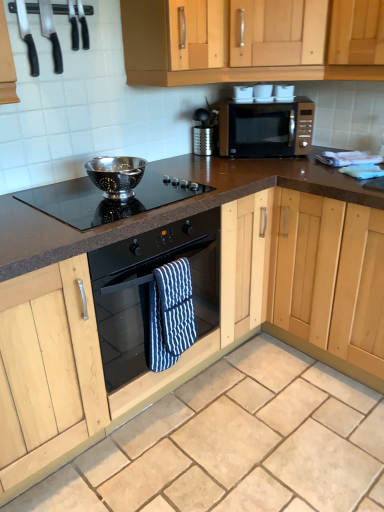
What is the approximate height of black glass cooktop at center?

It is 3.60 centimeters.

The width and height of the screenshot is (384, 512). In order to click on black plastic knives at upper left, placed as the 2th appliance when sorted from left to right in this screenshot , I will do point(51,33).

Image resolution: width=384 pixels, height=512 pixels. Describe the element at coordinates (51, 33) in the screenshot. I see `black plastic knives at upper left, placed as the 2th appliance when sorted from left to right` at that location.

The image size is (384, 512). What do you see at coordinates (27, 37) in the screenshot? I see `black plastic knives at upper left, which appears as the 1th appliance when viewed from the left` at bounding box center [27, 37].

Measure the distance between blue striped oven mitt at center and camera.

blue striped oven mitt at center is 1.48 meters from camera.

Identify the location of blue striped oven mitt at center. (168, 314).

Find the location of a particular element. The image size is (384, 512). light wood cabinet at upper center, which is the 2th cabinetry from bottom to top is located at coordinates (278, 32).

Measure the distance between point (265, 499) and camera.

Point (265, 499) and camera are 1.45 meters apart.

Where is `beige granite countertop at center`? beige granite countertop at center is located at coordinates (236, 444).

You are a GUI agent. You are given a task and a screenshot of the screen. Output one action in this format:
    pyautogui.click(x=<x>, y=<y>)
    Task: Click on the black glass oven at center
    This screenshot has height=512, width=384.
    Given the screenshot: What is the action you would take?
    pyautogui.click(x=148, y=289)

From a real-world perspective, between matte black oven at center, which is counted as the second cabinetry, starting from the top, and satin gold microwave at upper center, who is vertically higher?

satin gold microwave at upper center, from a real-world perspective.

Can you confirm if matte black oven at center, which is counted as the second cabinetry, starting from the top, is wider than satin gold microwave at upper center?

Indeed, matte black oven at center, which is counted as the second cabinetry, starting from the top, has a greater width compared to satin gold microwave at upper center.

Is matte black oven at center, arranged as the first cabinetry when ordered from the bottom, in contact with satin gold microwave at upper center?

matte black oven at center, arranged as the first cabinetry when ordered from the bottom, is not next to satin gold microwave at upper center, and they're not touching.

Locate an element on the screen. microwave oven above the matte black oven at center, arranged as the first cabinetry when ordered from the bottom (from the image's perspective) is located at coordinates (266, 128).

From a real-world perspective, between black glass cooktop at center and black plastic knives at upper left, placed as the 2th appliance when sorted from left to right, who is vertically higher?

From a 3D spatial view, black plastic knives at upper left, placed as the 2th appliance when sorted from left to right, is above.

Is black glass cooktop at center with black plastic knives at upper left, which ranks as the first appliance in right-to-left order?

No.

From the image's perspective, is black glass cooktop at center above or below black plastic knives at upper left, placed as the 2th appliance when sorted from left to right?

Clearly, from the image's perspective, black glass cooktop at center is below black plastic knives at upper left, placed as the 2th appliance when sorted from left to right.

Looking at their sizes, would you say black glass cooktop at center is wider or thinner than black plastic knives at upper left, which ranks as the first appliance in right-to-left order?

Clearly, black glass cooktop at center has more width compared to black plastic knives at upper left, which ranks as the first appliance in right-to-left order.

Considering the positions of objects blue striped oven mitt at center and satin gold microwave at upper center in the image provided, who is more to the left, blue striped oven mitt at center or satin gold microwave at upper center?

From the viewer's perspective, blue striped oven mitt at center appears more on the left side.

Is blue striped oven mitt at center looking in the opposite direction of satin gold microwave at upper center?

No, blue striped oven mitt at center is not facing the opposite direction of satin gold microwave at upper center.

The width and height of the screenshot is (384, 512). In order to click on bath towel lying below the satin gold microwave at upper center (from the image's perspective) in this screenshot , I will do `click(168, 314)`.

Who is smaller, light wood cabinet at upper center, which is the 2th cabinetry from bottom to top, or blue striped oven mitt at center?

Smaller between the two is blue striped oven mitt at center.

Is blue striped oven mitt at center a part of light wood cabinet at upper center, which appears as the first cabinetry when viewed from the top?

No, blue striped oven mitt at center is not surrounded by light wood cabinet at upper center, which appears as the first cabinetry when viewed from the top.

How much distance is there between light wood cabinet at upper center, which is the 2th cabinetry from bottom to top, and blue striped oven mitt at center?

They are 1.09 meters apart.

From the image's perspective, is light wood cabinet at upper center, which is the 2th cabinetry from bottom to top, above blue striped oven mitt at center?

Result: Yes.

Would you say black glass cooktop at center is outside blue striped oven mitt at center?

black glass cooktop at center lies outside blue striped oven mitt at center's area.

How much distance is there between black glass cooktop at center and blue striped oven mitt at center?

black glass cooktop at center and blue striped oven mitt at center are 15.69 inches apart.

Considering the sizes of objects black glass cooktop at center and blue striped oven mitt at center in the image provided, who is wider, black glass cooktop at center or blue striped oven mitt at center?

With larger width is black glass cooktop at center.

Is black glass cooktop at center in contact with blue striped oven mitt at center?

No, black glass cooktop at center is not touching blue striped oven mitt at center.

Where is `cabinetry that is on the right side of blue striped oven mitt at center`? cabinetry that is on the right side of blue striped oven mitt at center is located at coordinates (278, 32).

Which object is thinner, blue striped oven mitt at center or light wood cabinet at upper center, which is the 2th cabinetry from bottom to top?

Thinner between the two is blue striped oven mitt at center.

Considering the positions of objects blue striped oven mitt at center and light wood cabinet at upper center, which appears as the first cabinetry when viewed from the top, in the image provided, who is more to the right, blue striped oven mitt at center or light wood cabinet at upper center, which appears as the first cabinetry when viewed from the top,?

From the viewer's perspective, light wood cabinet at upper center, which appears as the first cabinetry when viewed from the top, appears more on the right side.

From a real-world perspective, is blue striped oven mitt at center over light wood cabinet at upper center, which is the 2th cabinetry from bottom to top?

No, from a real-world perspective, blue striped oven mitt at center is not over light wood cabinet at upper center, which is the 2th cabinetry from bottom to top

From a real-world perspective, who is located lower, black glass oven at center or black plastic knives at upper left, placed as the 2th appliance when sorted from left to right?

black glass oven at center is physically lower.

Measure the distance between black glass oven at center and black plastic knives at upper left, which ranks as the first appliance in right-to-left order.

black glass oven at center is 37.39 inches from black plastic knives at upper left, which ranks as the first appliance in right-to-left order.

Who is taller, black glass oven at center or black plastic knives at upper left, which ranks as the first appliance in right-to-left order?

black glass oven at center is taller.

From the image's perspective, is black glass oven at center beneath black plastic knives at upper left, placed as the 2th appliance when sorted from left to right?

Indeed, from the image's perspective, black glass oven at center is shown beneath black plastic knives at upper left, placed as the 2th appliance when sorted from left to right.

There is a matte black oven at center, which is counted as the second cabinetry, starting from the top. At what (x,y) coordinates should I click in order to perform the action: click on microwave oven above it (from a real-world perspective). Please return your answer as a coordinate pair (x, y). The height and width of the screenshot is (512, 384). Looking at the image, I should click on (266, 128).

The height and width of the screenshot is (512, 384). In the image, there is a black plastic knives at upper left, placed as the 2th appliance when sorted from left to right. In order to click on gas stove below it (from the image's perspective) in this screenshot , I will do `click(106, 199)`.

From the picture: From the image, which object appears to be farther from beige granite countertop at center, light wood cabinet at upper center, which is the 2th cabinetry from bottom to top, or blue striped oven mitt at center?

Based on the image, light wood cabinet at upper center, which is the 2th cabinetry from bottom to top, appears to be further to beige granite countertop at center.

Which object lies further to the anchor point satin gold microwave at upper center, blue striped oven mitt at center or black plastic knives at upper left, which ranks as the first appliance in right-to-left order?

Based on the image, black plastic knives at upper left, which ranks as the first appliance in right-to-left order, appears to be further to satin gold microwave at upper center.

Considering their positions, is black glass cooktop at center positioned closer to beige granite countertop at center than blue striped oven mitt at center?

blue striped oven mitt at center is closer to beige granite countertop at center.

From the image, which object appears to be nearer to light wood cabinet at upper center, which is the 2th cabinetry from bottom to top, matte black oven at center, which is counted as the second cabinetry, starting from the top, or black glass cooktop at center?

Among the two, black glass cooktop at center is located nearer to light wood cabinet at upper center, which is the 2th cabinetry from bottom to top.

Based on their spatial positions, is blue striped oven mitt at center or black plastic knives at upper left, which ranks as the first appliance in right-to-left order, further from black glass oven at center?

black plastic knives at upper left, which ranks as the first appliance in right-to-left order.

From the image, which object appears to be nearer to light wood cabinet at upper center, which appears as the first cabinetry when viewed from the top, satin gold microwave at upper center or black glass oven at center?

Based on the image, satin gold microwave at upper center appears to be nearer to light wood cabinet at upper center, which appears as the first cabinetry when viewed from the top.

Estimate the real-world distances between objects in this image. Which object is closer to black plastic knives at upper left, positioned as the second appliance in right-to-left order, black glass cooktop at center or beige granite countertop at center?

black glass cooktop at center is positioned closer to the anchor black plastic knives at upper left, positioned as the second appliance in right-to-left order.

Looking at the image, which one is located further to light wood cabinet at upper center, which is the 2th cabinetry from bottom to top, beige granite countertop at center or black glass cooktop at center?

Based on the image, beige granite countertop at center appears to be further to light wood cabinet at upper center, which is the 2th cabinetry from bottom to top.

I want to click on gas stove between light wood cabinet at upper center, which appears as the first cabinetry when viewed from the top, and matte black oven at center, arranged as the first cabinetry when ordered from the bottom, from top to bottom, so click(x=106, y=199).

I want to click on gas stove between black plastic knives at upper left, which appears as the 1th appliance when viewed from the left, and blue striped oven mitt at center, in the vertical direction, so click(106, 199).

Locate an element on the screen. oven between light wood cabinet at upper center, which appears as the first cabinetry when viewed from the top, and matte black oven at center, arranged as the first cabinetry when ordered from the bottom, in the vertical direction is located at coordinates (148, 289).

Locate an element on the screen. Image resolution: width=384 pixels, height=512 pixels. appliance between black plastic knives at upper left, which appears as the 1th appliance when viewed from the left, and satin gold microwave at upper center is located at coordinates (51, 33).